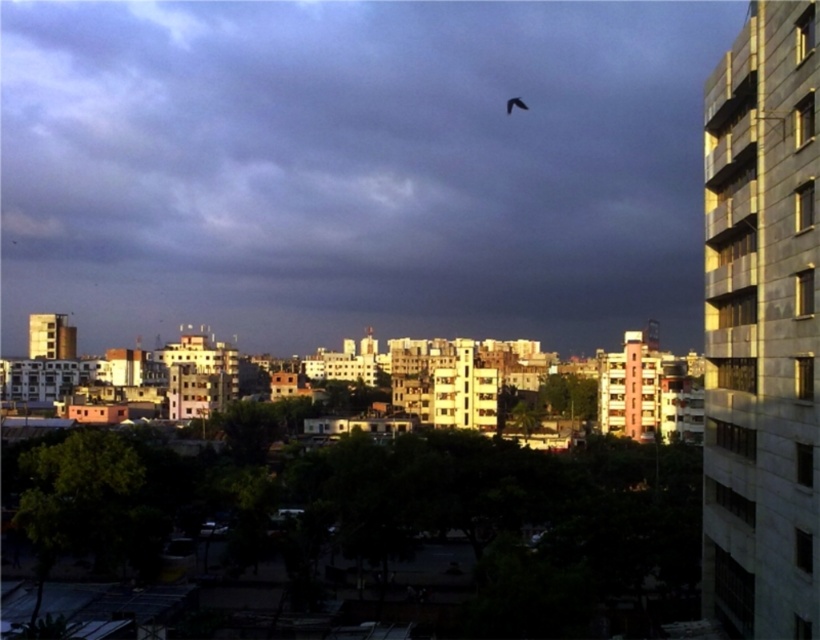
Is dark gray cloud at upper center smaller than silhouette feathered bird at upper center?

Actually, dark gray cloud at upper center might be larger than silhouette feathered bird at upper center.

Which of these two, dark gray cloud at upper center or silhouette feathered bird at upper center, stands shorter?

silhouette feathered bird at upper center is shorter.

Does point (37, 227) come closer to viewer compared to point (517, 100)?

No.

This screenshot has height=640, width=820. In order to click on dark gray cloud at upper center in this screenshot , I will do `click(354, 168)`.